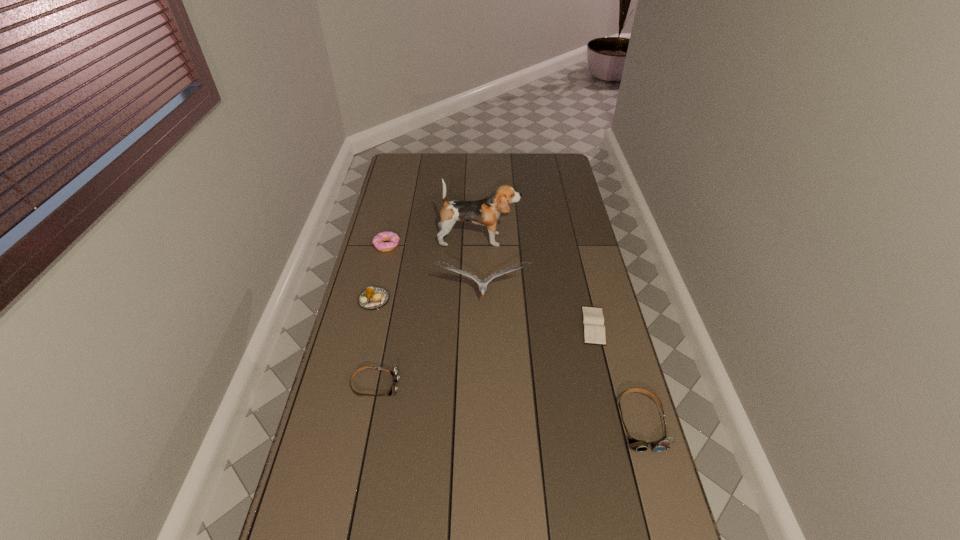
If equal spacing is desired by inserting an extra goggles among them, please point out a free spot for this new goggles. Please provide its 2D coordinates. Your answer should be formatted as a tuple, i.e. [(x, y)], where the tuple contains the x and y coordinates of a point satisfying the conditions above.

[(504, 403)]